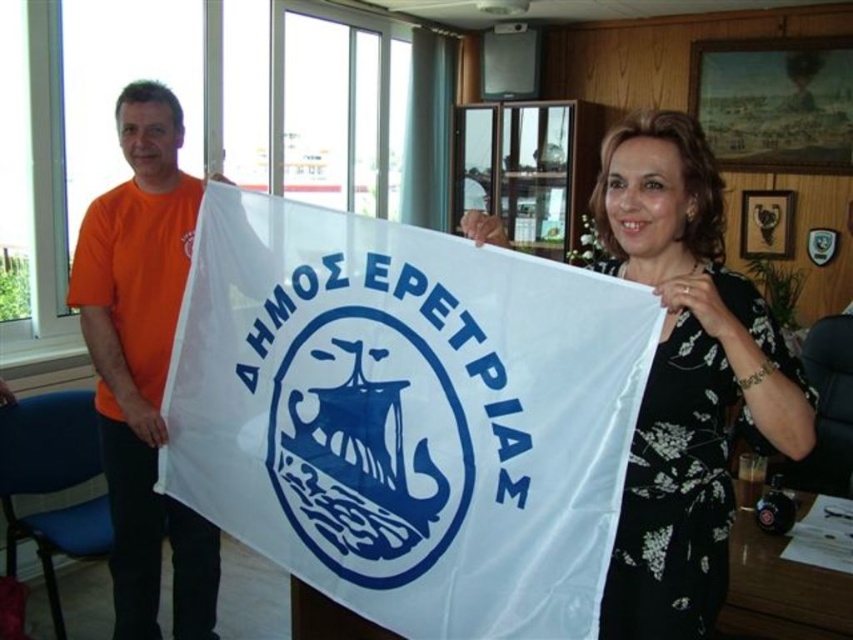
Does white fabric flag at center appear on the right side of orange t-shirt at left?

Correct, you'll find white fabric flag at center to the right of orange t-shirt at left.

Who is positioned more to the right, white fabric flag at center or orange t-shirt at left?

From the viewer's perspective, white fabric flag at center appears more on the right side.

Does point (413, 534) lie in front of point (122, 148)?

Yes, it is in front of point (122, 148).

This screenshot has height=640, width=853. In order to click on white fabric flag at center in this screenshot , I will do `click(405, 413)`.

Between white fabric flag at center and white floral dress at center, which one has more height?

Standing taller between the two is white floral dress at center.

Is white fabric flag at center positioned before white floral dress at center?

That is False.

Where is `white fabric flag at center`? Image resolution: width=853 pixels, height=640 pixels. white fabric flag at center is located at coordinates (405, 413).

Is white floral dress at center taller than orange t-shirt at left?

Incorrect, white floral dress at center's height is not larger of orange t-shirt at left's.

Can you confirm if white floral dress at center is wider than orange t-shirt at left?

Indeed, white floral dress at center has a greater width compared to orange t-shirt at left.

Does point (612, 627) come behind point (167, 116)?

That is False.

At what (x,y) coordinates should I click in order to perform the action: click on white floral dress at center. Please return your answer as a coordinate pair (x, y). Image resolution: width=853 pixels, height=640 pixels. Looking at the image, I should click on (685, 378).